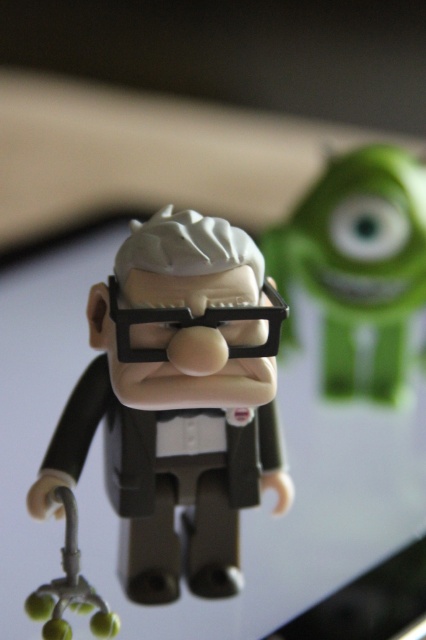
Is point (109, 316) closer to viewer compared to point (327, 182)?

That is True.

Which is in front, point (212, 540) or point (411, 188)?

Point (212, 540) is in front.

Find the location of `matte black figure at center`. matte black figure at center is located at coordinates pyautogui.click(x=176, y=403).